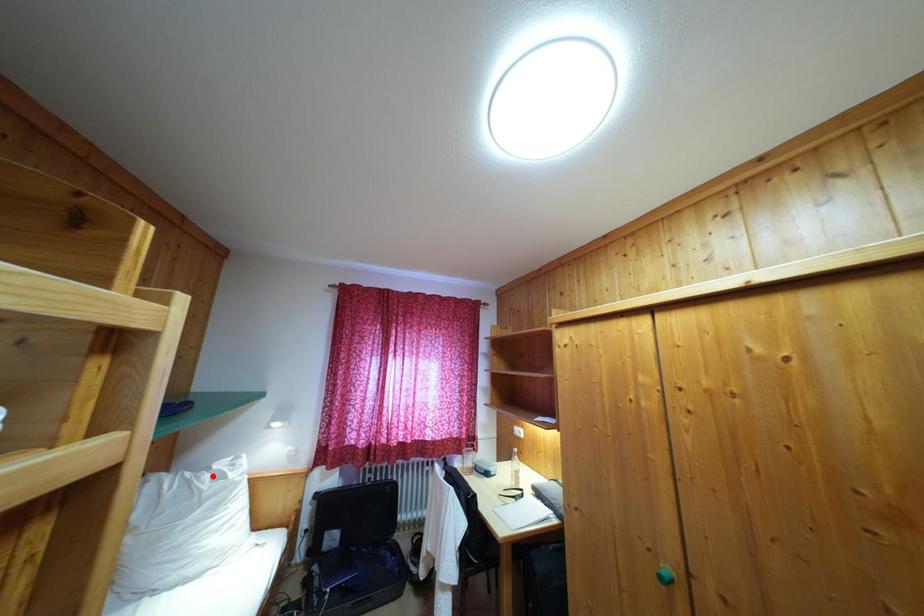
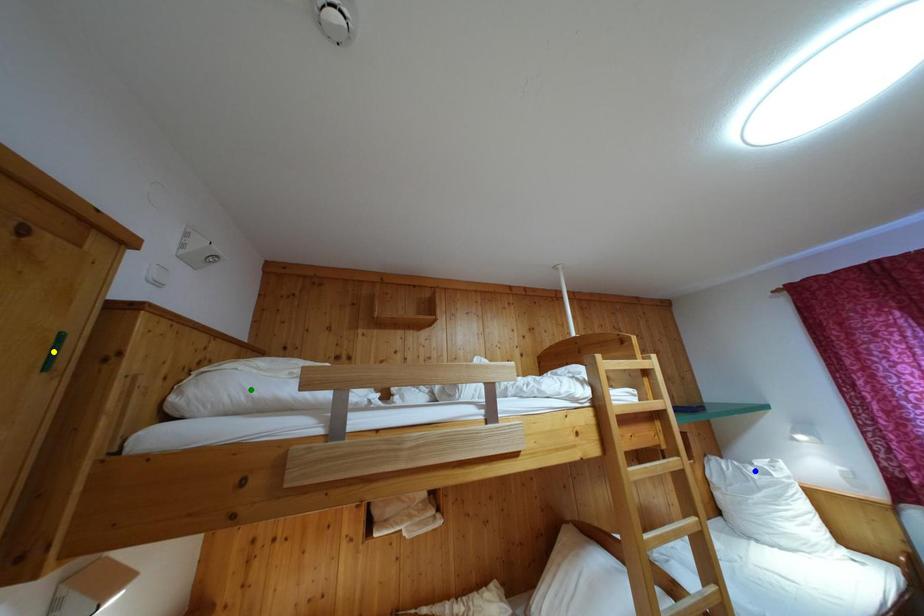
Question: I am providing you with two images of the same scene from different viewpoints. A red point is marked on the first image. You are given multiple points on the second image. Which spot in image 2 lines up with the point in image 1?

Choices:
 (A) yellow point
 (B) blue point
 (C) green point

Answer: (B)